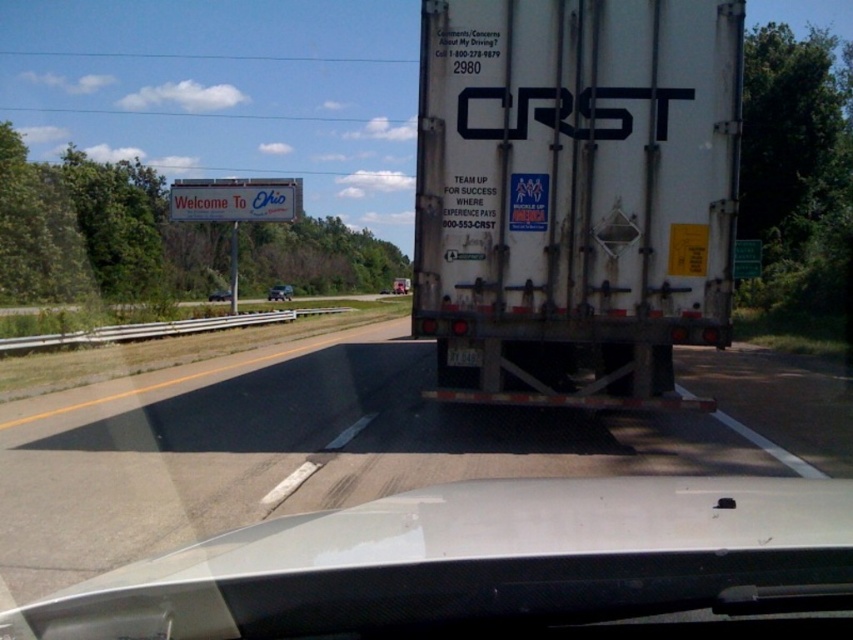
Question: Considering the real-world distances, which object is farthest from the matte black car at center?

Choices:
 (A) white matte train car at center
 (B) metallic silver sedan at center
 (C) white matte trailer truck at center

Answer: (A)

Question: Can you confirm if white matte trailer truck at center is bigger than matte black car at center?

Choices:
 (A) yes
 (B) no

Answer: (B)

Question: Which object is closer to the camera taking this photo?

Choices:
 (A) white matte trailer truck at center
 (B) metallic silver sedan at center
 (C) white glossy truck at center

Answer: (C)

Question: Can you confirm if white matte trailer truck at center is bigger than white glossy truck at center?

Choices:
 (A) no
 (B) yes

Answer: (A)

Question: Is white matte train car at center smaller than metallic silver sedan at center?

Choices:
 (A) yes
 (B) no

Answer: (A)

Question: Which of these objects is positioned closest to the white matte trailer truck at center?

Choices:
 (A) metallic silver sedan at center
 (B) matte black car at center
 (C) white glossy truck at center

Answer: (C)